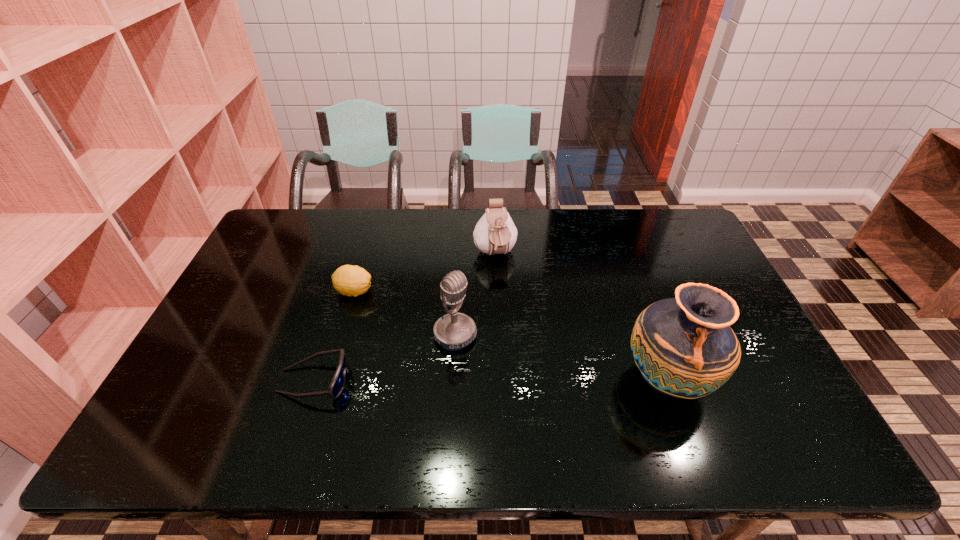
This screenshot has height=540, width=960. In order to click on sunglasses in this screenshot , I will do `click(337, 384)`.

In order to click on the rightmost object in this screenshot , I will do `click(684, 347)`.

You are a GUI agent. You are given a task and a screenshot of the screen. Output one action in this format:
    pyautogui.click(x=<x>, y=<y>)
    Task: Click on the pottery
    The height and width of the screenshot is (540, 960).
    Given the screenshot: What is the action you would take?
    pyautogui.click(x=684, y=347)

Where is `the third shortest object`? Image resolution: width=960 pixels, height=540 pixels. the third shortest object is located at coordinates (495, 233).

Where is `the farthest object`? The width and height of the screenshot is (960, 540). the farthest object is located at coordinates (495, 233).

I want to click on the second farthest object, so click(349, 280).

Identify the location of lemon. (349, 280).

At what (x,y) coordinates should I click in order to perform the action: click on microphone. Please return your answer as a coordinate pair (x, y). Looking at the image, I should click on (453, 331).

This screenshot has width=960, height=540. Identify the location of free space located on the front-facing side of the sunglasses. (397, 381).

You are a GUI agent. You are given a task and a screenshot of the screen. Output one action in this format:
    pyautogui.click(x=<x>, y=<y>)
    Task: Click on the vacant space located 0.060m on the left of the pottery
    The width and height of the screenshot is (960, 540).
    Given the screenshot: What is the action you would take?
    pyautogui.click(x=597, y=379)